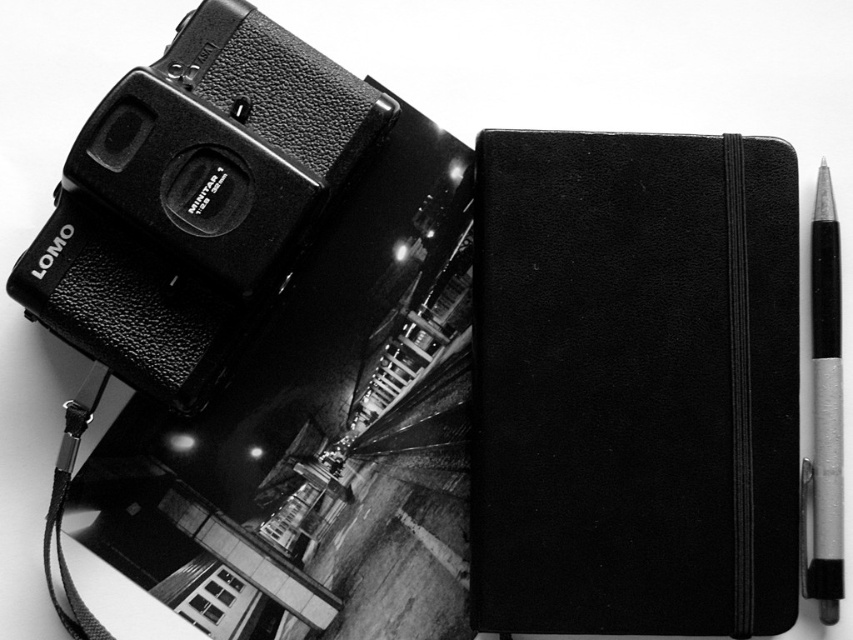
You are organizing a photography exhibit and need to place the black leather notebook at center and the rubberized black camera at upper left in a display case. According to the image, which object is located to the right of the other?

The black leather notebook at center is positioned on the right side of the rubberized black camera at upper left.

You are an artist who wants to sketch the scene in front of you. You need to decide which object to draw first based on their positions. Which object is closer to you, the black leather notebook at center or the rubberized black camera at upper left?

The black leather notebook at center is closer to you because it is further to the viewer than the rubberized black camera at upper left.

You are an art student analyzing the composition of this black and white image. You notice a specific point at coordinates (195,198). What object is located at that point?

The object at point (195,198) is the rubberized black camera at upper left.